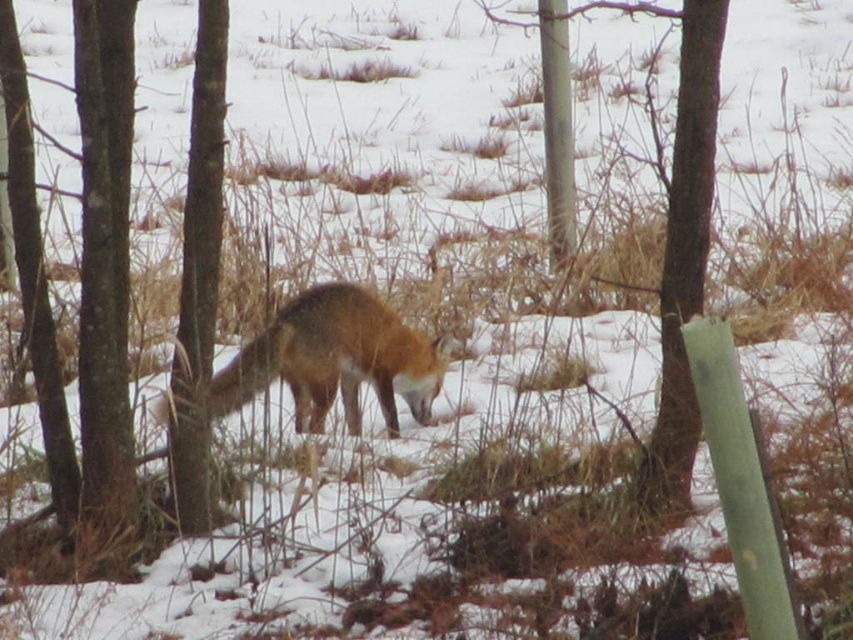
Which is above, smooth bark tree at left or smooth bark tree at center?

smooth bark tree at left is above.

Is point (125, 74) farther from camera compared to point (219, 173)?

No, (125, 74) is in front of (219, 173).

In the scene shown: Who is more forward, (97, 97) or (181, 492)?

Point (97, 97) is more forward.

You are a GUI agent. You are given a task and a screenshot of the screen. Output one action in this format:
    pyautogui.click(x=<x>, y=<y>)
    Task: Click on the smooth bark tree at left
    This screenshot has height=640, width=853.
    Given the screenshot: What is the action you would take?
    pyautogui.click(x=103, y=257)

Does fluffy reddish-brown fox at center appear on the right side of smooth bark tree at center?

Indeed, fluffy reddish-brown fox at center is positioned on the right side of smooth bark tree at center.

Between point (251, 392) and point (213, 35), which one is positioned in front?

Point (213, 35) is in front.

In the scene shown: Who is more distant from viewer, (335, 323) or (215, 244)?

The point (335, 323) is more distant.

Identify the location of fluffy reddish-brown fox at center. This screenshot has height=640, width=853. (335, 358).

Image resolution: width=853 pixels, height=640 pixels. Describe the element at coordinates (674, 228) in the screenshot. I see `brown wood tree at center` at that location.

Does brown wood tree at center come behind fluffy reddish-brown fox at center?

Yes, it is.

Does point (692, 310) come farther from viewer compared to point (294, 308)?

No, (692, 310) is closer to viewer.

In order to click on brown wood tree at center in this screenshot , I will do `click(674, 228)`.